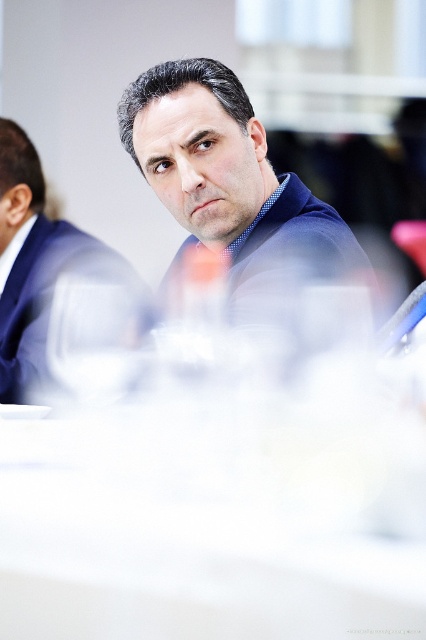
Who is more distant from viewer, (97, 596) or (187, 64)?

Point (187, 64)

Which is more to the right, white glossy table at center or blue sweater at center?

Positioned to the right is blue sweater at center.

The height and width of the screenshot is (640, 426). What are the coordinates of `white glossy table at center` in the screenshot? It's located at (178, 561).

Locate an element on the screen. The width and height of the screenshot is (426, 640). blue sweater at center is located at coordinates (230, 179).

Can you confirm if blue sweater at center is positioned above matte blue suit at center?

Yes, blue sweater at center is above matte blue suit at center.

This screenshot has width=426, height=640. Find the location of `blue sweater at center`. blue sweater at center is located at coordinates (230, 179).

Between white glossy table at center and matte blue suit at center, which one has more height?

matte blue suit at center

Does white glossy table at center appear on the right side of matte blue suit at center?

Yes, white glossy table at center is to the right of matte blue suit at center.

Locate an element on the screen. This screenshot has width=426, height=640. white glossy table at center is located at coordinates (178, 561).